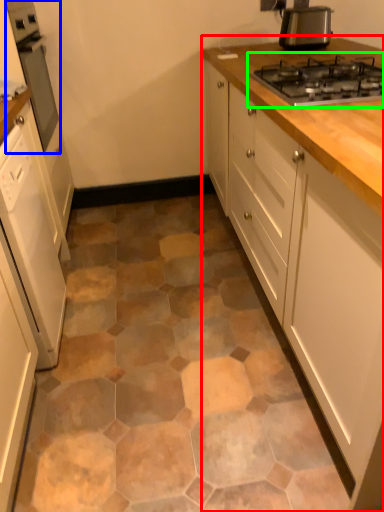
Question: Based on their relative distances, which object is farther from cabinetry (highlighted by a red box)? Choose from home appliance (highlighted by a blue box) and gas stove (highlighted by a green box).

Choices:
 (A) home appliance
 (B) gas stove

Answer: (A)